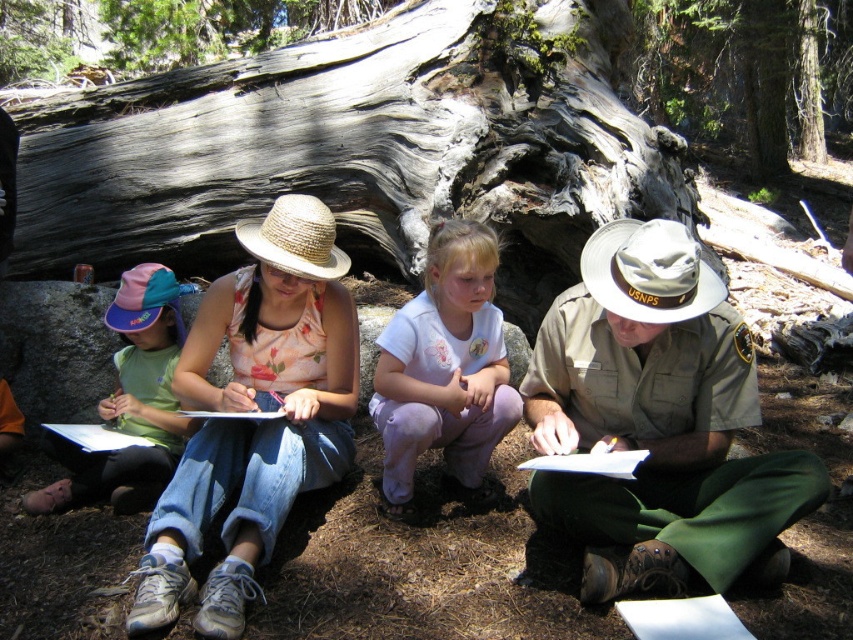
Does point (637, 272) come behind point (181, 65)?

No, (637, 272) is in front of (181, 65).

Between point (711, 490) and point (45, 33), which one is positioned behind?

The point (45, 33) is more distant.

Who is more distant from viewer, (x=538, y=326) or (x=48, y=51)?

Point (x=48, y=51)

The height and width of the screenshot is (640, 853). Identify the location of khaki uniform at center. (657, 420).

Which is more to the left, khaki uniform at center or gray rough bark tree at upper center?

khaki uniform at center

Is point (688, 387) positioned after point (694, 92)?

No.

Between point (608, 369) and point (677, 72), which one is positioned in front?

Point (608, 369) is more forward.

The height and width of the screenshot is (640, 853). I want to click on khaki uniform at center, so click(657, 420).

Is khaki uniform at center bigger than matte straw hat at center?

No.

Is khaki uniform at center positioned in front of matte straw hat at center?

No, it is not.

Image resolution: width=853 pixels, height=640 pixels. Identify the location of khaki uniform at center. (657, 420).

This screenshot has height=640, width=853. I want to click on khaki uniform at center, so click(x=657, y=420).